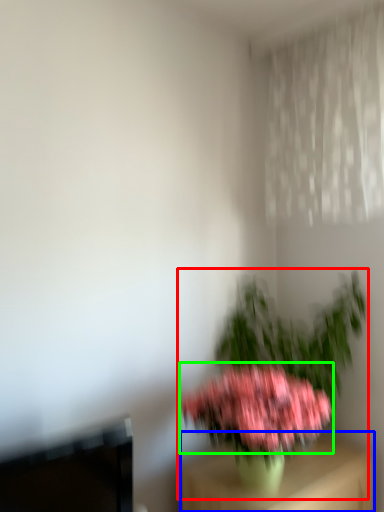
Question: Which is nearer to the houseplant (highlighted by a red box)? furniture (highlighted by a blue box) or flower (highlighted by a green box).

Choices:
 (A) furniture
 (B) flower

Answer: (A)